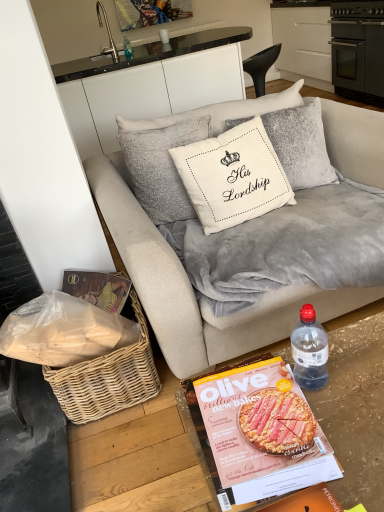
Where is `free space above matte paper magazine at lower center (from a real-world perspective)`? free space above matte paper magazine at lower center (from a real-world perspective) is located at coordinates (248, 417).